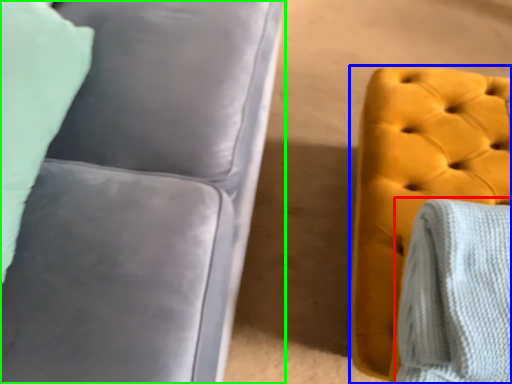
Question: Which object is positioned closest to blanket (highlighted by a red box)? Select from furniture (highlighted by a blue box) and studio couch (highlighted by a green box).

Choices:
 (A) furniture
 (B) studio couch

Answer: (A)